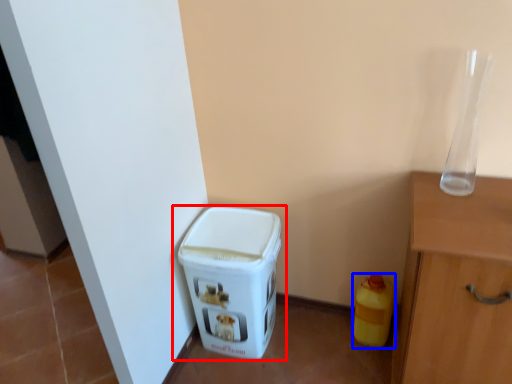
Question: Which object is further to the camera taking this photo, waste container (highlighted by a red box) or bottle (highlighted by a blue box)?

Choices:
 (A) waste container
 (B) bottle

Answer: (B)